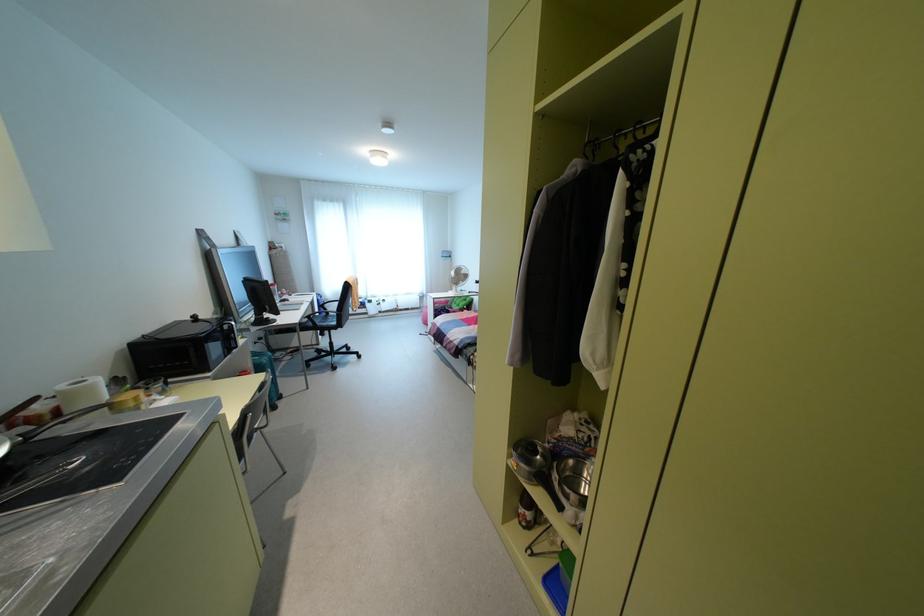
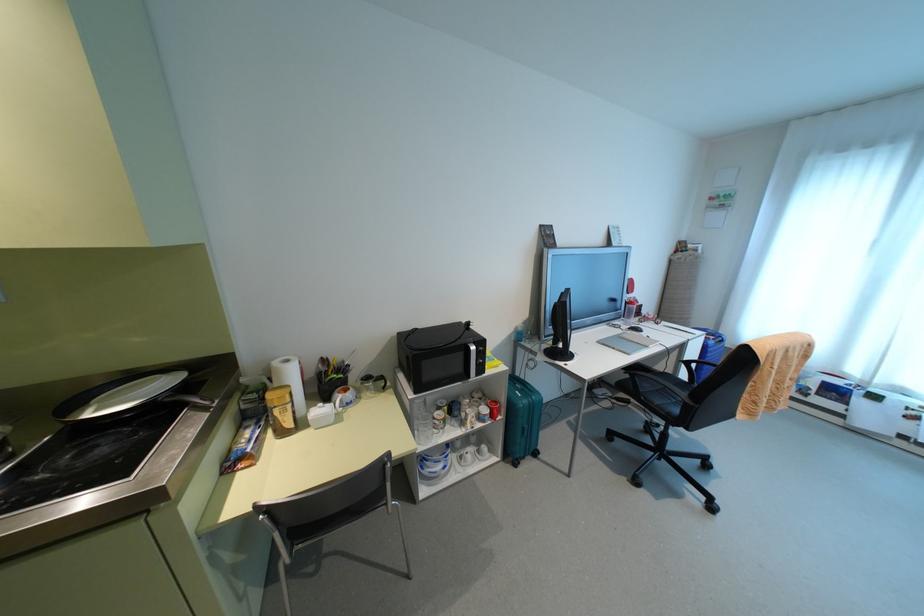
Where in the second image is the point corresponding to pixel 280 395 from the first image?

(535, 454)